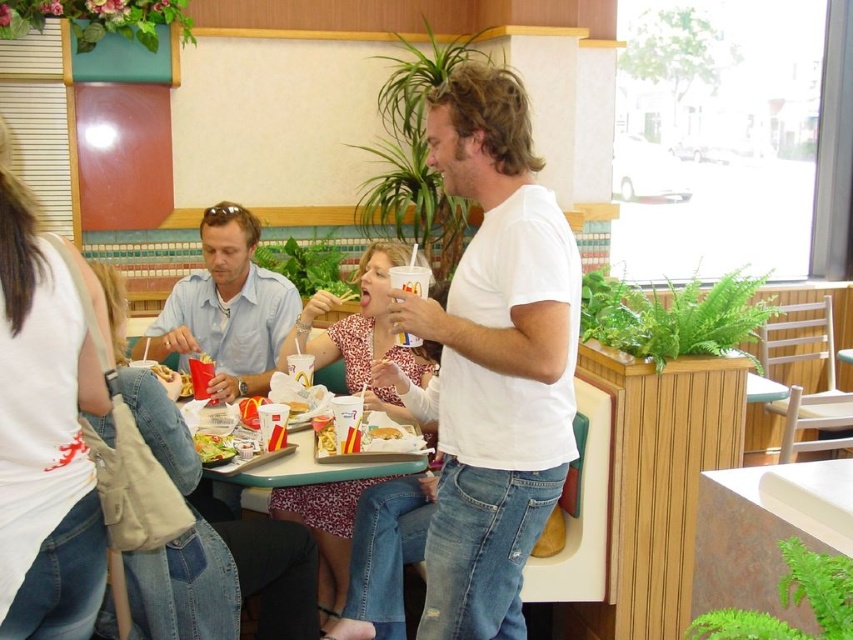
Measure the distance between white cotton t-shirt at center and floral dress at center.

white cotton t-shirt at center is 32.42 inches from floral dress at center.

Where is `white cotton t-shirt at center`? This screenshot has width=853, height=640. white cotton t-shirt at center is located at coordinates (494, 358).

Between floral dress at center and yellow paper cup at center, which one is positioned lower?

yellow paper cup at center is lower down.

Who is higher up, floral dress at center or yellow paper cup at center?

floral dress at center is higher up.

What do you see at coordinates (360, 333) in the screenshot? I see `floral dress at center` at bounding box center [360, 333].

Locate an element on the screen. The width and height of the screenshot is (853, 640). floral dress at center is located at coordinates (360, 333).

Between plastic tray at center and yellow paper cup at center, which one is positioned lower?

Positioned lower is plastic tray at center.

Does plastic tray at center have a greater width compared to yellow paper cup at center?

Indeed, plastic tray at center has a greater width compared to yellow paper cup at center.

Find the location of a particular element. This screenshot has width=853, height=640. plastic tray at center is located at coordinates (218, 506).